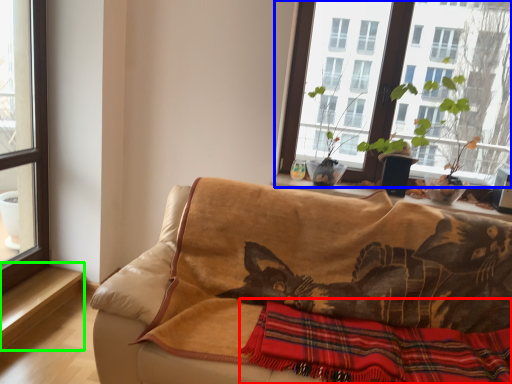
Question: Based on their relative distances, which object is nearer to plaid (highlighted by a red box)? Choose from window (highlighted by a blue box) and window sill (highlighted by a green box).

Choices:
 (A) window
 (B) window sill

Answer: (A)